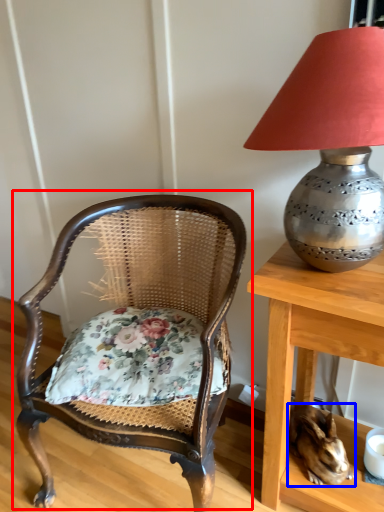
Question: Which of the following is the farthest to the observer, chair (highlighted by a red box) or rabbit (highlighted by a blue box)?

Choices:
 (A) chair
 (B) rabbit

Answer: (B)